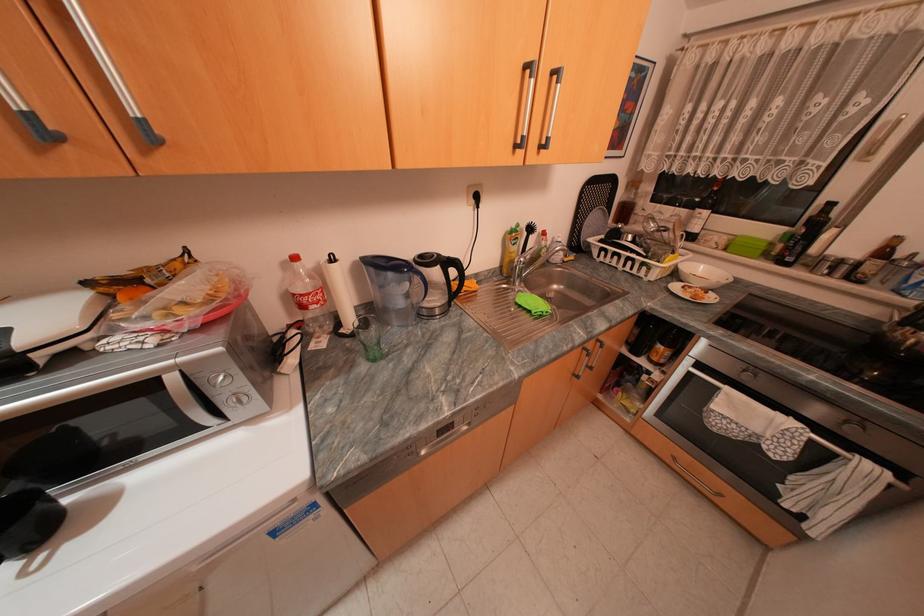
You are a GUI agent. You are given a task and a screenshot of the screen. Output one action in this format:
    pyautogui.click(x=<x>, y=<y>)
    Task: Click on the green drinking glass
    
    Given the screenshot: What is the action you would take?
    pyautogui.click(x=369, y=337)